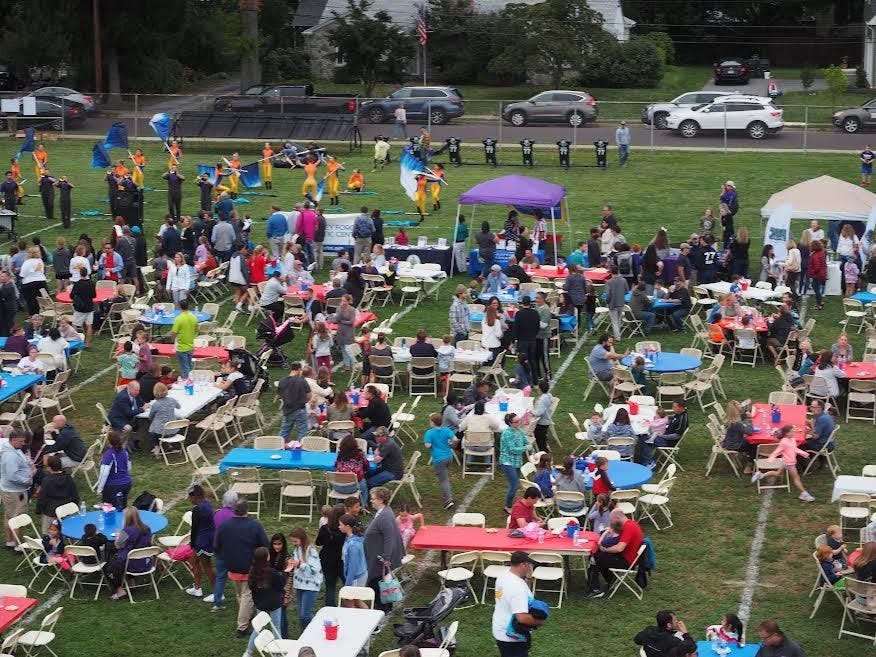
Find the location of a particular element. The width and height of the screenshot is (876, 657). 10 visibly red tables is located at coordinates (18, 602), (99, 294), (203, 351), (315, 284), (479, 539), (781, 417), (864, 373), (745, 320), (357, 401), (368, 315).